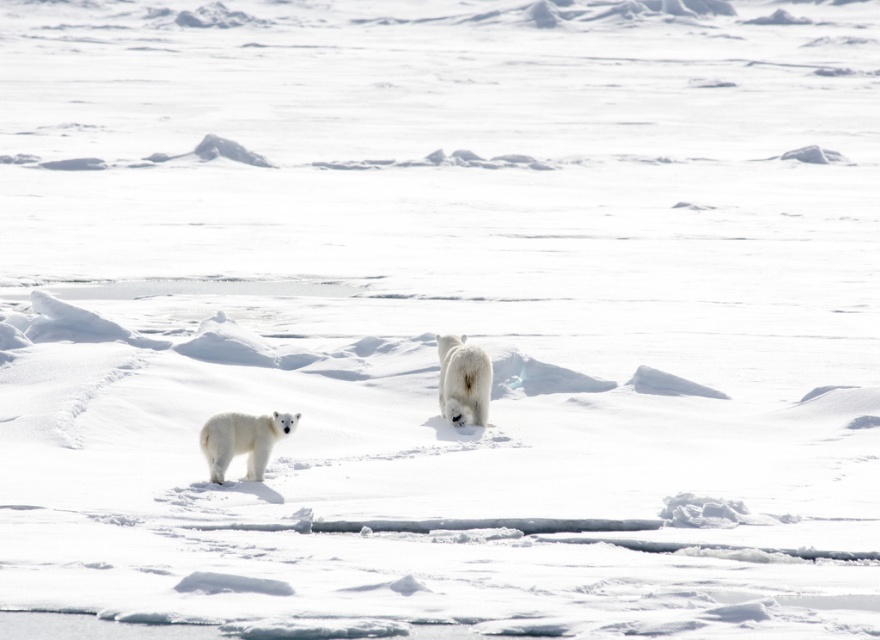
Question: Which object is closer to the camera taking this photo?

Choices:
 (A) white fluffy bear cub at lower left
 (B) white fluffy bear at center

Answer: (A)

Question: Among these points, which one is farthest from the camera?

Choices:
 (A) (451, 419)
 (B) (204, 438)

Answer: (A)

Question: Is white fluffy bear cub at lower left positioned at the back of white fluffy bear at center?

Choices:
 (A) no
 (B) yes

Answer: (A)

Question: Does white fluffy bear cub at lower left have a larger size compared to white fluffy bear at center?

Choices:
 (A) no
 (B) yes

Answer: (A)

Question: Is white fluffy bear cub at lower left positioned in front of white fluffy bear at center?

Choices:
 (A) no
 (B) yes

Answer: (B)